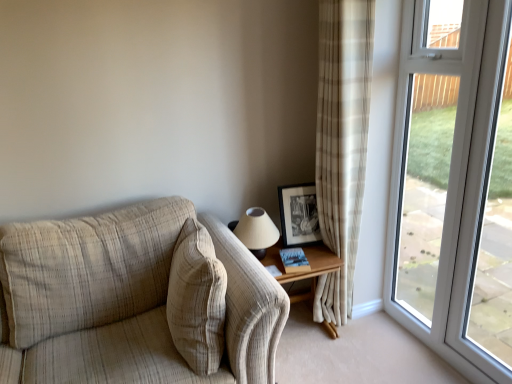
Question: Can you confirm if beige plaid curtain at right is smaller than transparent glass screen door at right?

Choices:
 (A) yes
 (B) no

Answer: (B)

Question: Considering the relative sizes of beige plaid curtain at right and transparent glass screen door at right in the image provided, is beige plaid curtain at right shorter than transparent glass screen door at right?

Choices:
 (A) yes
 (B) no

Answer: (B)

Question: Can you confirm if beige plaid curtain at right is thinner than transparent glass screen door at right?

Choices:
 (A) no
 (B) yes

Answer: (A)

Question: Considering the relative sizes of beige plaid curtain at right and transparent glass screen door at right in the image provided, is beige plaid curtain at right wider than transparent glass screen door at right?

Choices:
 (A) no
 (B) yes

Answer: (B)

Question: Is beige plaid curtain at right behind transparent glass screen door at right?

Choices:
 (A) yes
 (B) no

Answer: (A)

Question: Is beige plaid curtain at right touching transparent glass screen door at right?

Choices:
 (A) yes
 (B) no

Answer: (B)

Question: Is hardcover book at lower right thinner than beige fabric couch at left?

Choices:
 (A) no
 (B) yes

Answer: (B)

Question: Is hardcover book at lower right located outside beige fabric couch at left?

Choices:
 (A) no
 (B) yes

Answer: (B)

Question: Considering the relative sizes of hardcover book at lower right and beige fabric couch at left in the image provided, is hardcover book at lower right smaller than beige fabric couch at left?

Choices:
 (A) yes
 (B) no

Answer: (A)

Question: Is hardcover book at lower right facing away from beige fabric couch at left?

Choices:
 (A) yes
 (B) no

Answer: (B)

Question: Would you consider hardcover book at lower right to be distant from beige fabric couch at left?

Choices:
 (A) yes
 (B) no

Answer: (B)

Question: Is hardcover book at lower right in contact with beige fabric couch at left?

Choices:
 (A) no
 (B) yes

Answer: (A)

Question: Is transparent glass window at right with wooden table at right?

Choices:
 (A) no
 (B) yes

Answer: (A)